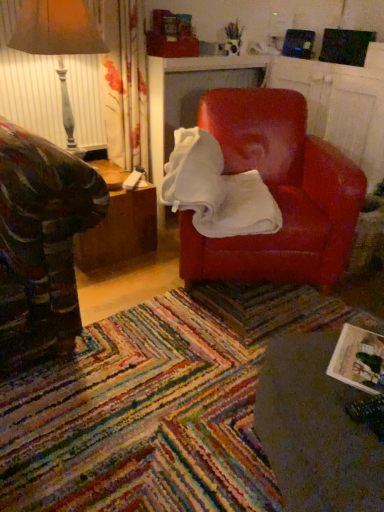
Question: In terms of size, does matte red armchair at center appear bigger or smaller than matte white magazine at lower right?

Choices:
 (A) big
 (B) small

Answer: (A)

Question: Looking at their shapes, would you say matte red armchair at center is wider or thinner than matte white magazine at lower right?

Choices:
 (A) thin
 (B) wide

Answer: (B)

Question: Estimate the real-world distances between objects in this image. Which object is farther from the matte red armchair at center?

Choices:
 (A) matte white magazine at lower right
 (B) matte leather chair at center
 (C) matte gray table lamp at left
 (D) wooden table at lower right, which is the first table from front to back
 (E) woodenmaterial/texturetable at left, the first table viewed from the left

Answer: (C)

Question: Which object is positioned farthest from the woodenmaterial/texturetable at left, the first table when ordered from back to front?

Choices:
 (A) matte leather chair at center
 (B) matte white magazine at lower right
 (C) wooden table at lower right, the 2th table when ordered from back to front
 (D) matte red armchair at center
 (E) matte gray table lamp at left

Answer: (B)